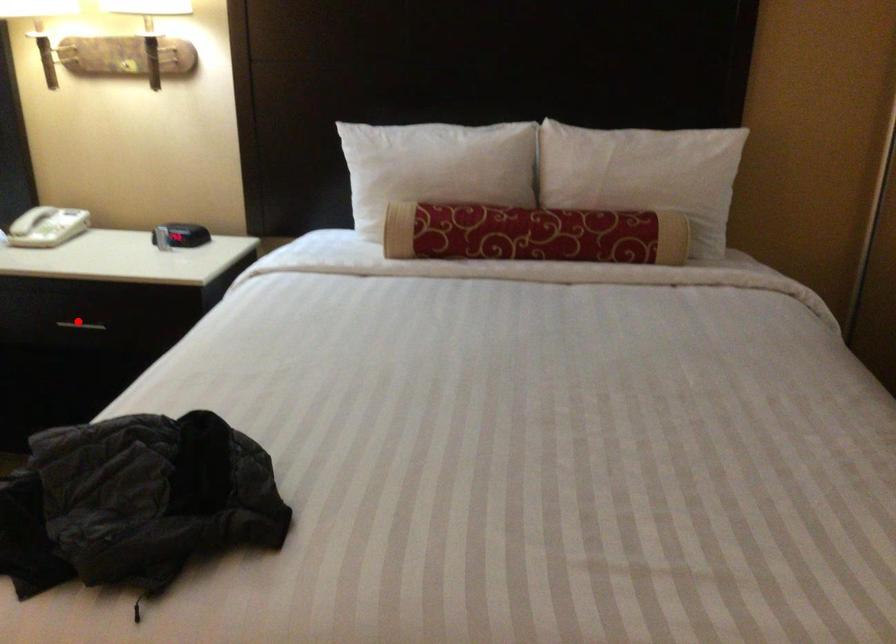
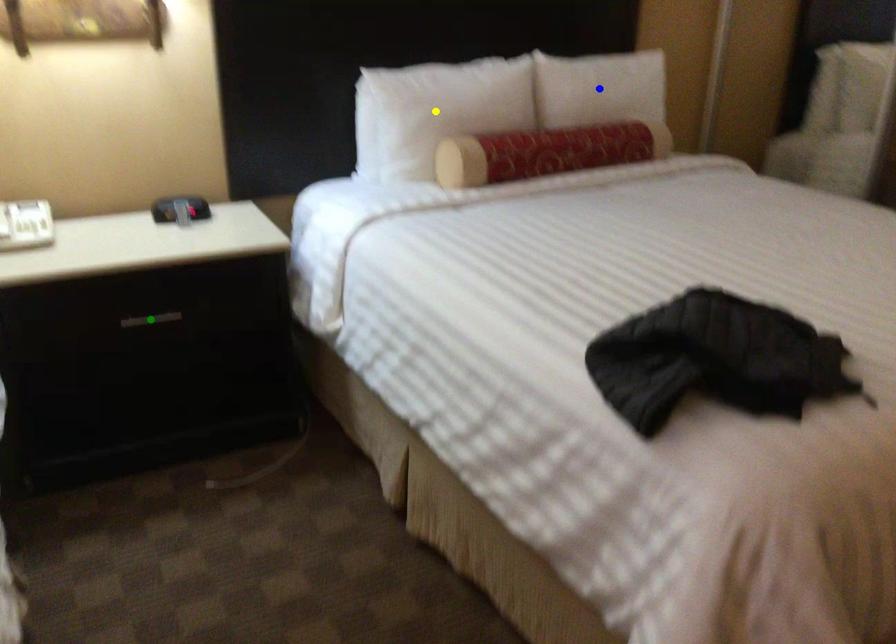
Question: I am providing you with two images of the same scene from different viewpoints. A red point is marked on the first image. You are given multiple points on the second image. Which point in image 2 is actually the same real-world point as the red point in image 1?

Choices:
 (A) blue point
 (B) yellow point
 (C) green point

Answer: (C)